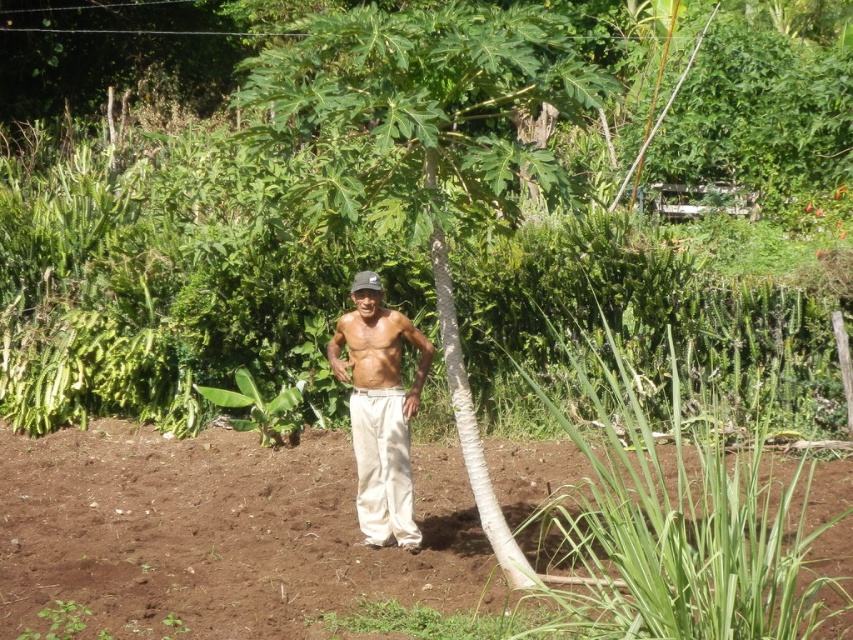
Question: Can you confirm if green leafy banana tree at center is wider than white cotton pants at center?

Choices:
 (A) yes
 (B) no

Answer: (A)

Question: Is white cotton pants at center to the left of black fabric baseball hat at center from the viewer's perspective?

Choices:
 (A) yes
 (B) no

Answer: (B)

Question: Which point is farther to the camera?

Choices:
 (A) brown soil at center
 (B) black fabric baseball hat at center

Answer: (A)

Question: Which object is positioned closest to the brown soil at center?

Choices:
 (A) black fabric baseball hat at center
 (B) green leafy banana tree at center
 (C) white cotton pants at center

Answer: (C)

Question: Estimate the real-world distances between objects in this image. Which object is closer to the brown soil at center?

Choices:
 (A) black fabric baseball hat at center
 (B) white cotton pants at center
 (C) green leafy banana tree at center

Answer: (B)

Question: Is brown soil at center positioned behind white cotton pants at center?

Choices:
 (A) yes
 (B) no

Answer: (A)